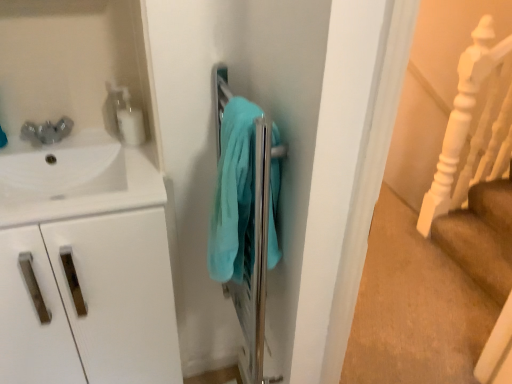
Question: From a real-world perspective, is white matte cabinet at left below white glossy sink at upper left?

Choices:
 (A) yes
 (B) no

Answer: (A)

Question: Is white matte cabinet at left in contact with white glossy sink at upper left?

Choices:
 (A) no
 (B) yes

Answer: (A)

Question: Can you confirm if white matte cabinet at left is bigger than white glossy sink at upper left?

Choices:
 (A) no
 (B) yes

Answer: (B)

Question: Can we say white matte cabinet at left lies outside white glossy sink at upper left?

Choices:
 (A) no
 (B) yes

Answer: (B)

Question: Can you confirm if white matte cabinet at left is shorter than white glossy sink at upper left?

Choices:
 (A) yes
 (B) no

Answer: (B)

Question: Would you say white matte cabinet at left is a long distance from white glossy sink at upper left?

Choices:
 (A) no
 (B) yes

Answer: (A)

Question: Can white matte cabinet at left be found inside white glossy sink at upper left?

Choices:
 (A) yes
 (B) no

Answer: (B)

Question: Can you confirm if white glossy sink at upper left is bigger than white matte cabinet at left?

Choices:
 (A) yes
 (B) no

Answer: (B)

Question: Is white glossy sink at upper left placed right next to white matte cabinet at left?

Choices:
 (A) yes
 (B) no

Answer: (B)

Question: From a real-world perspective, is white glossy sink at upper left on white matte cabinet at left?

Choices:
 (A) no
 (B) yes

Answer: (B)

Question: Does white glossy sink at upper left come in front of white matte cabinet at left?

Choices:
 (A) no
 (B) yes

Answer: (B)

Question: From a real-world perspective, is white glossy sink at upper left below white matte cabinet at left?

Choices:
 (A) no
 (B) yes

Answer: (A)

Question: Is white wooden stair rail at right touching white glossy soap dispenser at upper left?

Choices:
 (A) no
 (B) yes

Answer: (A)